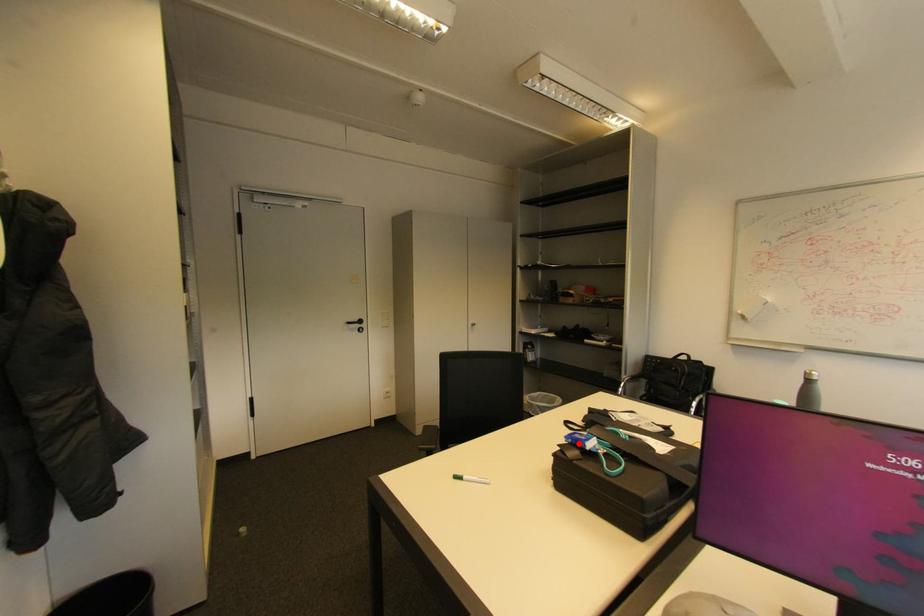
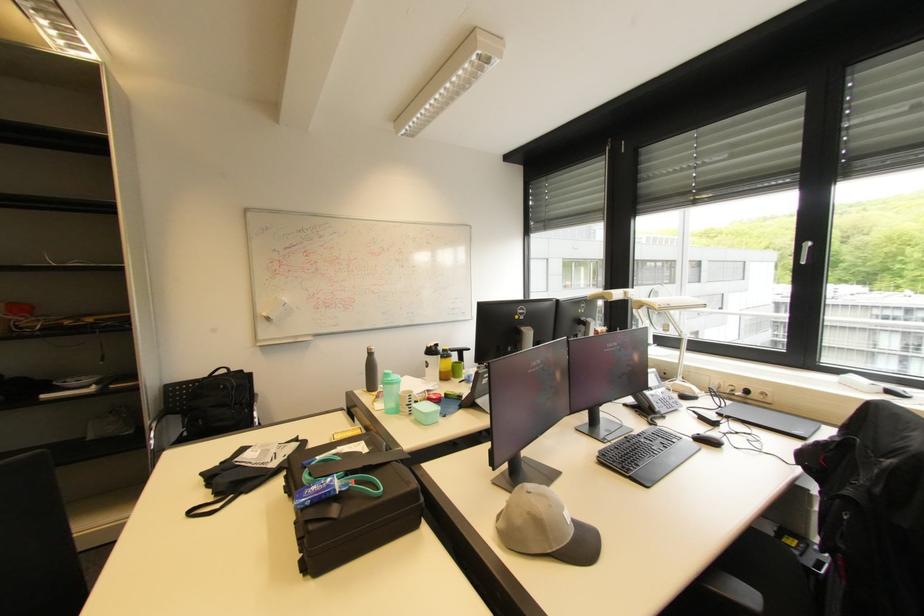
Question: I am providing you with two images of the same scene from different viewpoints. A red point is shown in image1. For the corresponding object point in image2, is it positioned nearer or farther from the camera?

Choices:
 (A) Nearer
 (B) Farther

Answer: (B)